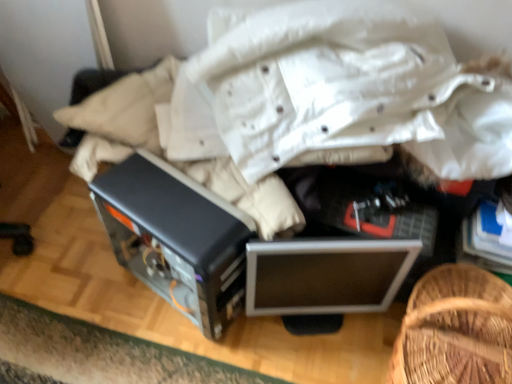
Question: Is silver metallic monitor at center positioned with its back to woven wood basket at lower right?

Choices:
 (A) no
 (B) yes

Answer: (A)

Question: Is silver metallic monitor at center wider than woven wood basket at lower right?

Choices:
 (A) no
 (B) yes

Answer: (A)

Question: Is silver metallic monitor at center outside of woven wood basket at lower right?

Choices:
 (A) yes
 (B) no

Answer: (A)

Question: Is silver metallic monitor at center touching woven wood basket at lower right?

Choices:
 (A) no
 (B) yes

Answer: (A)

Question: Considering the relative positions of silver metallic monitor at center and woven wood basket at lower right in the image provided, is silver metallic monitor at center to the right of woven wood basket at lower right from the viewer's perspective?

Choices:
 (A) yes
 (B) no

Answer: (B)

Question: Considering the positions of point (186, 288) and point (458, 312), is point (186, 288) closer or farther from the camera than point (458, 312)?

Choices:
 (A) farther
 (B) closer

Answer: (A)

Question: Considering the positions of satin black computer case at center and woven wood basket at lower right in the image, is satin black computer case at center wider or thinner than woven wood basket at lower right?

Choices:
 (A) thin
 (B) wide

Answer: (B)

Question: Would you say satin black computer case at center is inside or outside woven wood basket at lower right?

Choices:
 (A) inside
 (B) outside

Answer: (B)

Question: From the image's perspective, is satin black computer case at center positioned above or below woven wood basket at lower right?

Choices:
 (A) above
 (B) below

Answer: (A)

Question: Do you think woven wood basket at lower right is within silver metallic monitor at center, or outside of it?

Choices:
 (A) inside
 (B) outside

Answer: (B)

Question: From a real-world perspective, is woven wood basket at lower right above or below silver metallic monitor at center?

Choices:
 (A) below
 (B) above

Answer: (B)

Question: Considering the positions of woven wood basket at lower right and silver metallic monitor at center in the image, is woven wood basket at lower right bigger or smaller than silver metallic monitor at center?

Choices:
 (A) big
 (B) small

Answer: (A)

Question: In the image, is woven wood basket at lower right positioned in front of or behind silver metallic monitor at center?

Choices:
 (A) behind
 (B) front

Answer: (B)

Question: From the image's perspective, is silver metallic monitor at center located above or below satin black computer case at center?

Choices:
 (A) above
 (B) below

Answer: (B)

Question: Is silver metallic monitor at center bigger or smaller than satin black computer case at center?

Choices:
 (A) big
 (B) small

Answer: (B)